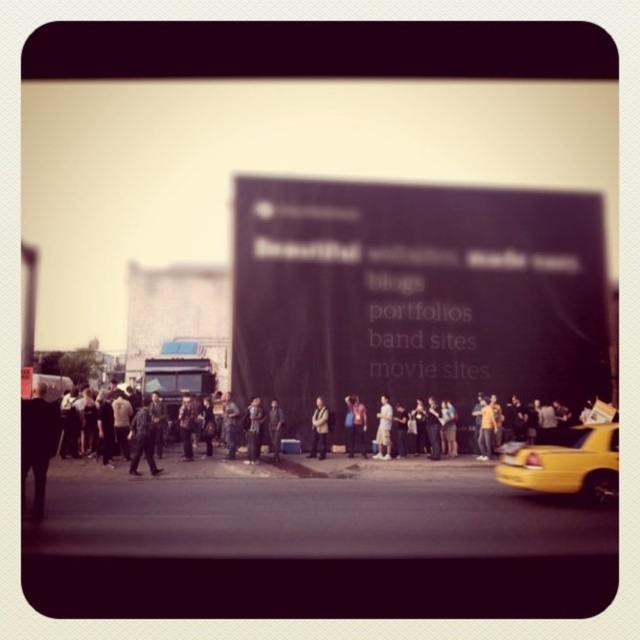
You are a pedestrian standing at the center of the sidewalk and see the yellow matte taxi at lower right and the light brown leather jacket at center. Which object is closer to your right side?

The yellow matte taxi at lower right is positioned on the right side of light brown leather jacket at center, so from your perspective at the center, the yellow matte taxi at lower right is closer to your right side.